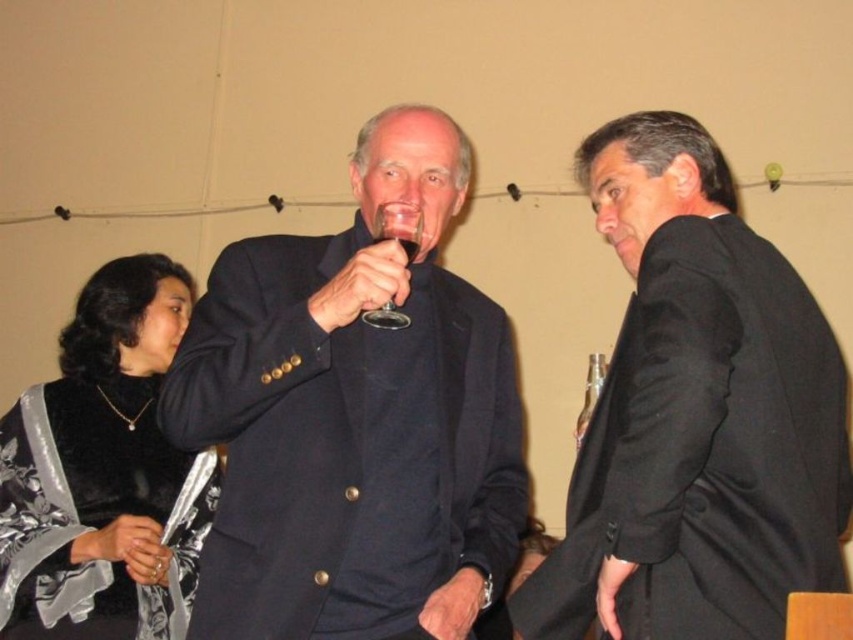
Question: In this image, where is velvet black dress at lower left located relative to clear glass wine at center?

Choices:
 (A) above
 (B) below

Answer: (B)

Question: Which point is closer to the camera?

Choices:
 (A) black satin suit at right
 (B) velvet black dress at lower left

Answer: (A)

Question: Is the position of matte black suit at center more distant than that of velvet black dress at lower left?

Choices:
 (A) no
 (B) yes

Answer: (A)

Question: Which object is positioned closest to the clear glass wine at center?

Choices:
 (A) transparent glass at center
 (B) matte black suit at center
 (C) velvet black dress at lower left

Answer: (A)

Question: Which object is positioned closest to the black satin suit at right?

Choices:
 (A) matte black suit at center
 (B) velvet black dress at lower left
 (C) clear glass wine at center
 (D) transparent glass at center

Answer: (A)

Question: Does velvet black dress at lower left have a greater width compared to transparent glass at center?

Choices:
 (A) no
 (B) yes

Answer: (B)